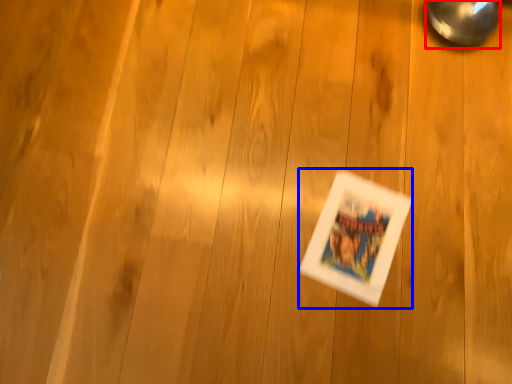
Question: Which of the following is the farthest to the observer, magnifying glass (highlighted by a red box) or comic book (highlighted by a blue box)?

Choices:
 (A) magnifying glass
 (B) comic book

Answer: (A)